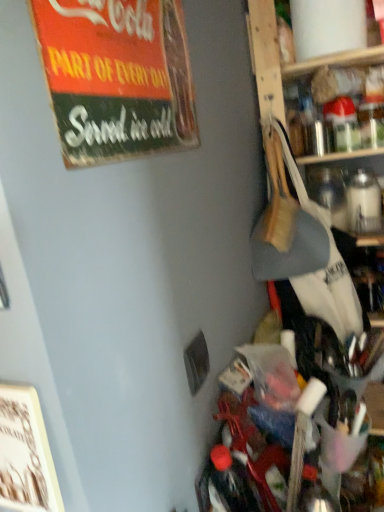
The height and width of the screenshot is (512, 384). Describe the element at coordinates (116, 77) in the screenshot. I see `vintage cardboard sign at upper left` at that location.

Where is `vintage cardboard sign at upper left`? vintage cardboard sign at upper left is located at coordinates (116, 77).

At what (x,y) coordinates should I click in order to perform the action: click on clear glass bottle at upper right. Please return your answer as a coordinate pair (x, y). The height and width of the screenshot is (512, 384). Looking at the image, I should click on (342, 124).

What do you see at coordinates (342, 124) in the screenshot? Image resolution: width=384 pixels, height=512 pixels. I see `clear glass bottle at upper right` at bounding box center [342, 124].

Measure the distance between clear glass bottle at upper right and camera.

The distance of clear glass bottle at upper right from camera is 1.17 meters.

This screenshot has width=384, height=512. Identify the location of vintage cardboard sign at upper left. (116, 77).

Considering the relative positions of vintage cardboard sign at upper left and clear glass bottle at upper right in the image provided, is vintage cardboard sign at upper left to the right of clear glass bottle at upper right from the viewer's perspective?

In fact, vintage cardboard sign at upper left is to the left of clear glass bottle at upper right.

Does vintage cardboard sign at upper left come behind clear glass bottle at upper right?

No, the depth of vintage cardboard sign at upper left is less than that of clear glass bottle at upper right.

Is point (111, 114) in front of point (360, 145)?

Yes.

From the image's perspective, who appears lower, vintage cardboard sign at upper left or clear glass bottle at upper right?

vintage cardboard sign at upper left is shown below in the image.

From a real-world perspective, who is located lower, vintage cardboard sign at upper left or clear glass bottle at upper right?

clear glass bottle at upper right, from a real-world perspective.

Which object is thinner, vintage cardboard sign at upper left or clear glass bottle at upper right?

vintage cardboard sign at upper left is thinner.

In the scene shown: Can you confirm if vintage cardboard sign at upper left is taller than clear glass bottle at upper right?

Indeed, vintage cardboard sign at upper left has a greater height compared to clear glass bottle at upper right.

Considering the relative sizes of vintage cardboard sign at upper left and clear glass bottle at upper right in the image provided, is vintage cardboard sign at upper left smaller than clear glass bottle at upper right?

No.

Would you say vintage cardboard sign at upper left is inside or outside clear glass bottle at upper right?

vintage cardboard sign at upper left is outside clear glass bottle at upper right.

Can you see vintage cardboard sign at upper left touching clear glass bottle at upper right?

No, vintage cardboard sign at upper left is not next to clear glass bottle at upper right.

Is vintage cardboard sign at upper left oriented towards clear glass bottle at upper right?

No, vintage cardboard sign at upper left is not aimed at clear glass bottle at upper right.

What's the angular difference between vintage cardboard sign at upper left and clear glass bottle at upper right's facing directions?

The angle between the facing direction of vintage cardboard sign at upper left and the facing direction of clear glass bottle at upper right is 88 degrees.

Where is `bulletin board on the left of clear glass bottle at upper right`? bulletin board on the left of clear glass bottle at upper right is located at coordinates (116, 77).

Between clear glass bottle at upper right and vintage cardboard sign at upper left, which one appears on the left side from the viewer's perspective?

From the viewer's perspective, vintage cardboard sign at upper left appears more on the left side.

Considering the positions of objects clear glass bottle at upper right and vintage cardboard sign at upper left in the image provided, who is in front, clear glass bottle at upper right or vintage cardboard sign at upper left?

vintage cardboard sign at upper left is in front.

Considering the positions of point (347, 119) and point (192, 125), is point (347, 119) closer or farther from the camera than point (192, 125)?

Point (347, 119) is farther from the camera than point (192, 125).

From the image's perspective, is clear glass bottle at upper right located beneath vintage cardboard sign at upper left?

No.

From a real-world perspective, which is physically above, clear glass bottle at upper right or vintage cardboard sign at upper left?

From a 3D spatial view, vintage cardboard sign at upper left is above.

Considering the sizes of objects clear glass bottle at upper right and vintage cardboard sign at upper left in the image provided, who is thinner, clear glass bottle at upper right or vintage cardboard sign at upper left?

vintage cardboard sign at upper left.

Is clear glass bottle at upper right shorter than vintage cardboard sign at upper left?

Correct, clear glass bottle at upper right is not as tall as vintage cardboard sign at upper left.

Which of these two, clear glass bottle at upper right or vintage cardboard sign at upper left, is smaller?

clear glass bottle at upper right is smaller.

Would you say vintage cardboard sign at upper left is part of clear glass bottle at upper right's contents?

No, vintage cardboard sign at upper left is located outside of clear glass bottle at upper right.

Is clear glass bottle at upper right not close to vintage cardboard sign at upper left?

No, clear glass bottle at upper right is in close proximity to vintage cardboard sign at upper left.

Is vintage cardboard sign at upper left at the back of clear glass bottle at upper right?

No, clear glass bottle at upper right is not facing the opposite direction of vintage cardboard sign at upper left.

How far apart are clear glass bottle at upper right and vintage cardboard sign at upper left?

clear glass bottle at upper right is 30.63 inches away from vintage cardboard sign at upper left.

Locate an element on the screen. bottle behind the vintage cardboard sign at upper left is located at coordinates (342, 124).

At what (x,y) coordinates should I click in order to perform the action: click on bulletin board located on the left of clear glass bottle at upper right. Please return your answer as a coordinate pair (x, y). Looking at the image, I should click on (116, 77).

This screenshot has width=384, height=512. What are the coordinates of `bottle on the right of vintage cardboard sign at upper left` in the screenshot? It's located at (342, 124).